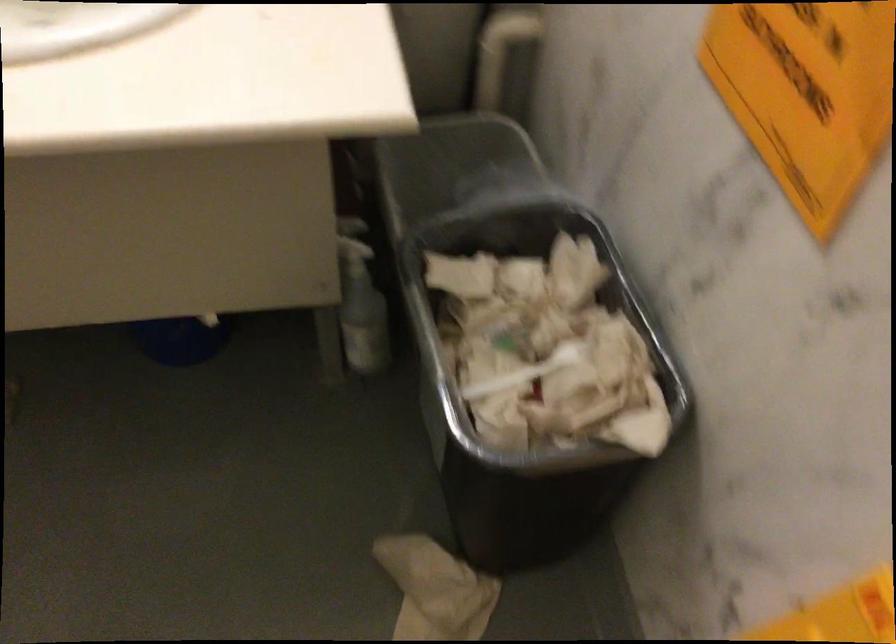
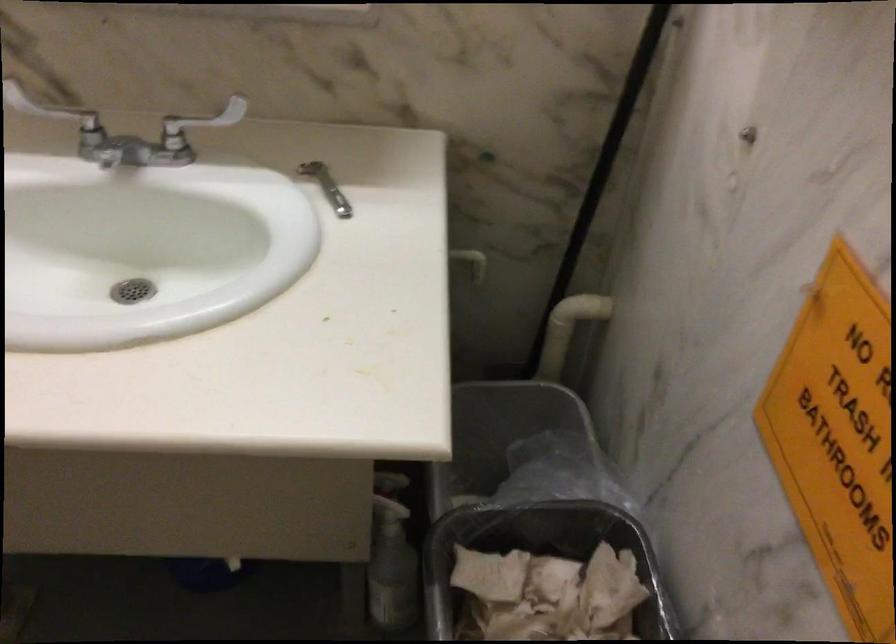
Which direction would the cameraman need to move to produce the second image?

The movement direction of the cameraman is right, forward.